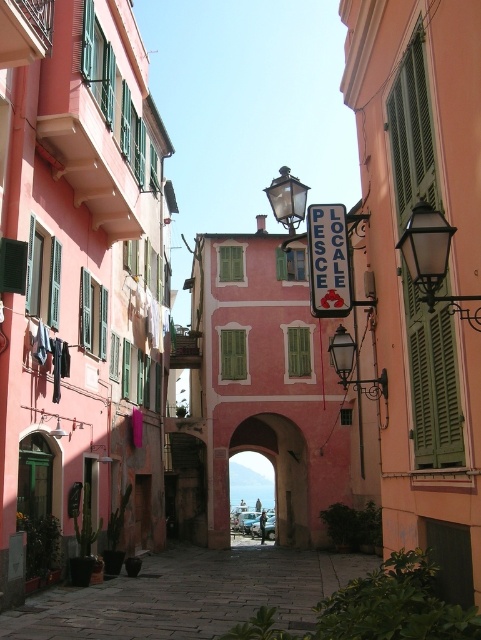
What do you see at coordinates (329, 260) in the screenshot? I see `white plastic sign at center` at bounding box center [329, 260].

Which is below, white plastic sign at center or dark gray fabric at left?

dark gray fabric at left is below.

Identify the location of white plastic sign at center. (329, 260).

From the picture: Is white plastic sign at center further to camera compared to matte black lamp at upper right?

Yes, white plastic sign at center is further from the viewer.

Can you confirm if white plastic sign at center is positioned below matte black lamp at upper right?

Correct, white plastic sign at center is located below matte black lamp at upper right.

Who is more distant from viewer, [309,296] or [448,300]?

The point [309,296] is more distant.

At what (x,y) coordinates should I click in order to perform the action: click on white plastic sign at center. Please return your answer as a coordinate pair (x, y). Looking at the image, I should click on (329, 260).

Is white plastic sign at center shorter than green matte shutter at center?

Correct, white plastic sign at center is not as tall as green matte shutter at center.

Is white plastic sign at center smaller than green matte shutter at center?

Indeed, white plastic sign at center has a smaller size compared to green matte shutter at center.

Does point (312, 214) come farther from viewer compared to point (235, 365)?

No, (312, 214) is closer to viewer.

The image size is (481, 640). Identify the location of white plastic sign at center. (329, 260).